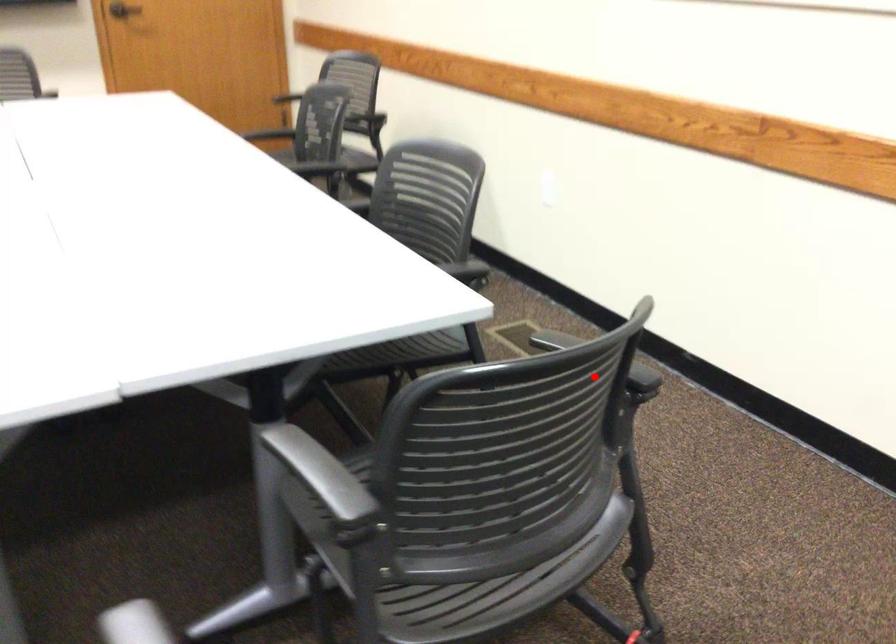
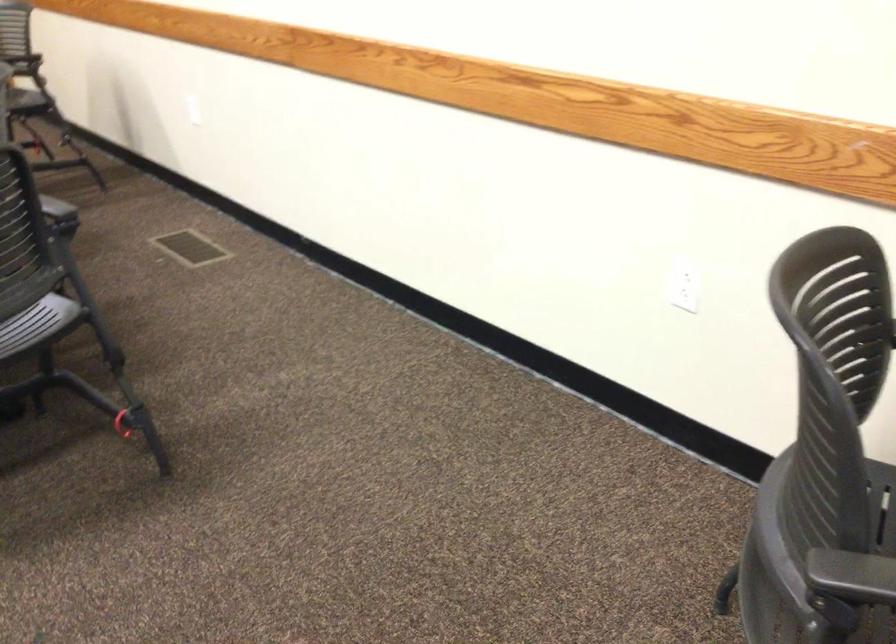
In the second image, find the point that corresponds to the highlighted location in the first image.

(56, 207)